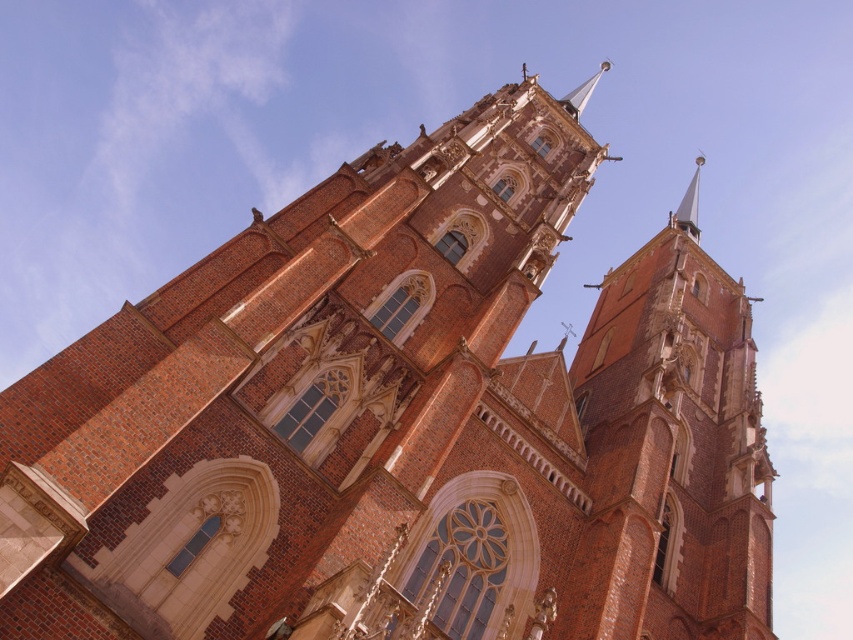
You are standing in front of the Gothic church and notice a specific point marked at coordinates (670, 456). Which architectural feature of the church does this point correspond to?

The point at coordinates (670, 456) corresponds to the matte brick tower at right.

Consider the image. You are an architect examining the church from the front. You notice the matte brick tower at right and the smooth gold spire at upper right. Which of these two structures is located higher up on the facade?

The smooth gold spire at upper right is positioned higher up on the facade than the matte brick tower at right.